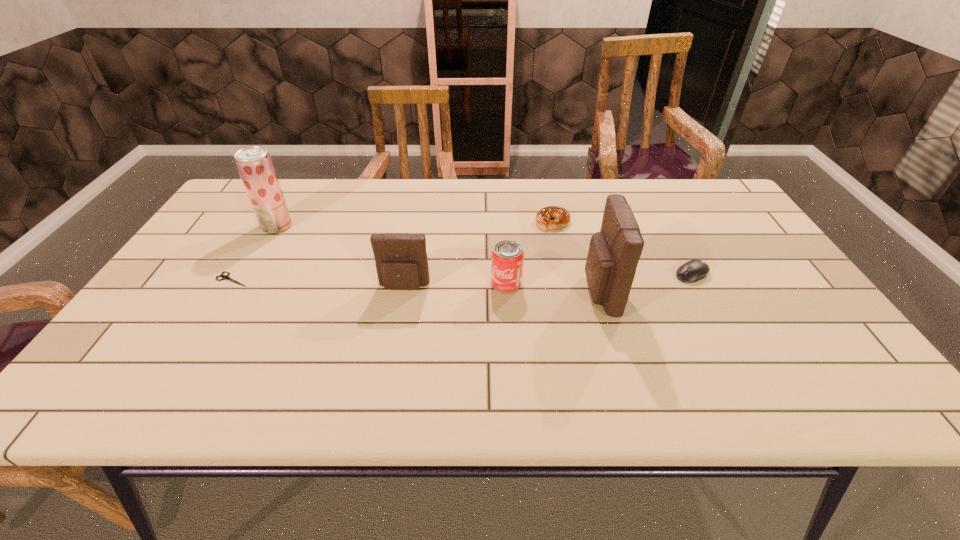
Find the location of `vacant area between the left pouch and the computer mouse`. vacant area between the left pouch and the computer mouse is located at coordinates (548, 281).

The height and width of the screenshot is (540, 960). In order to click on free area in between the fruit juice and the shorter pouch in this screenshot , I will do `click(341, 256)`.

Where is `object that stands as the fourth closest to the rightmost object`? The height and width of the screenshot is (540, 960). object that stands as the fourth closest to the rightmost object is located at coordinates pyautogui.click(x=401, y=260).

Image resolution: width=960 pixels, height=540 pixels. I want to click on object that can be found as the closest to the bagel, so click(614, 252).